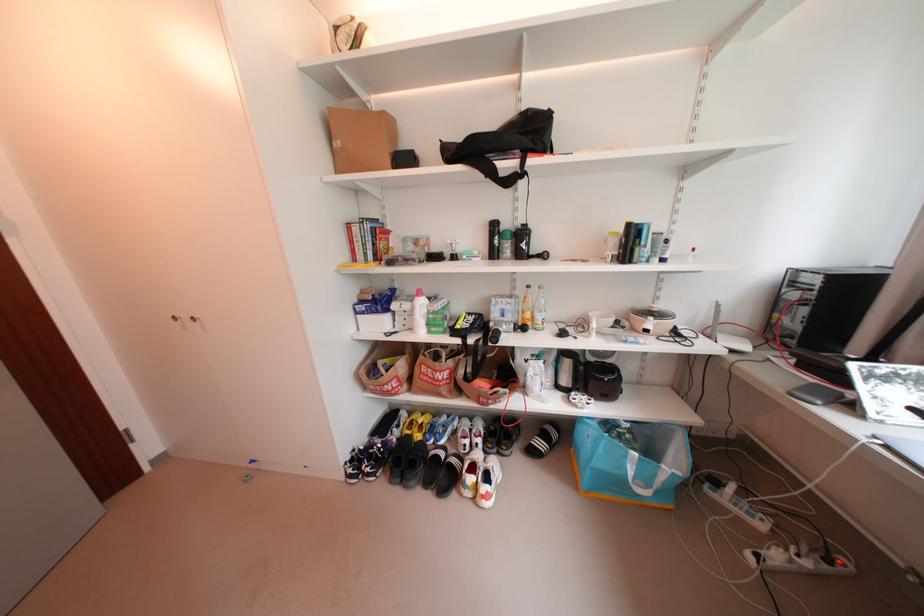
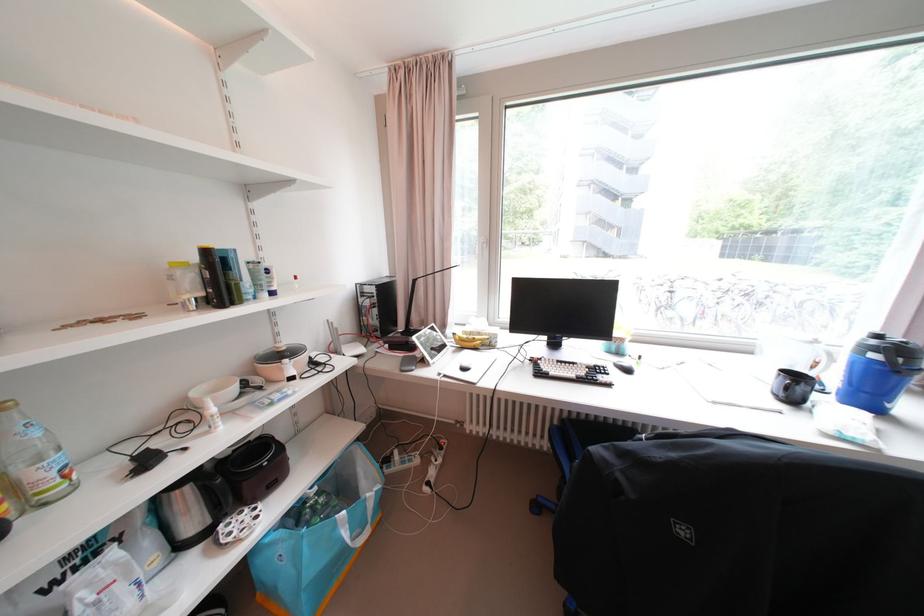
Locate, in the second image, the point that corresponds to (x=821, y=379) in the first image.

(409, 355)